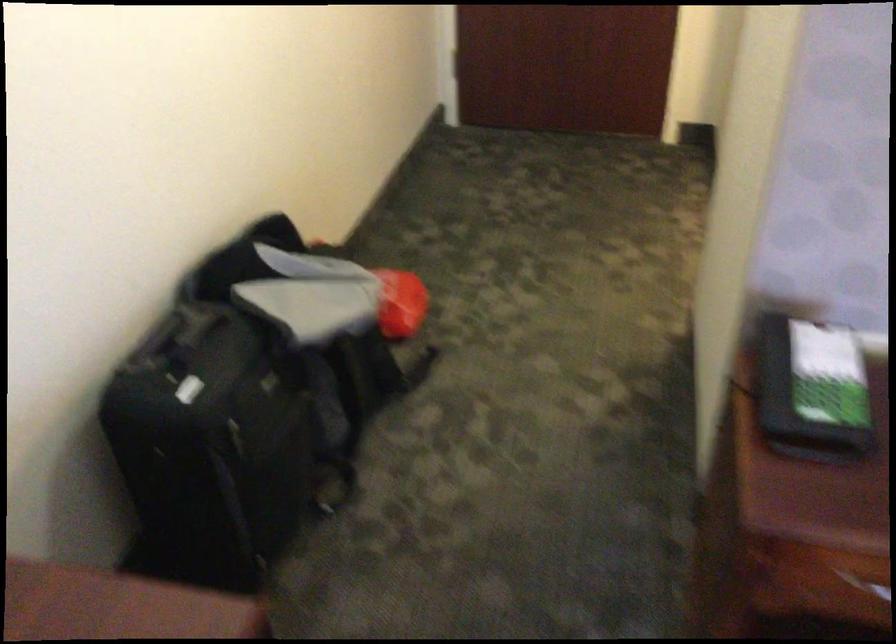
The location [401,303] corresponds to which object?

This point indicates the red bag.